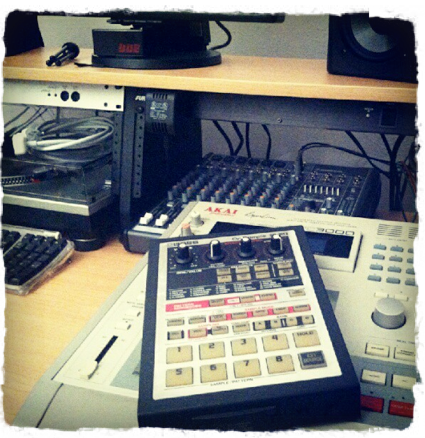
This screenshot has width=425, height=438. I want to click on display screen, so click(x=315, y=243).